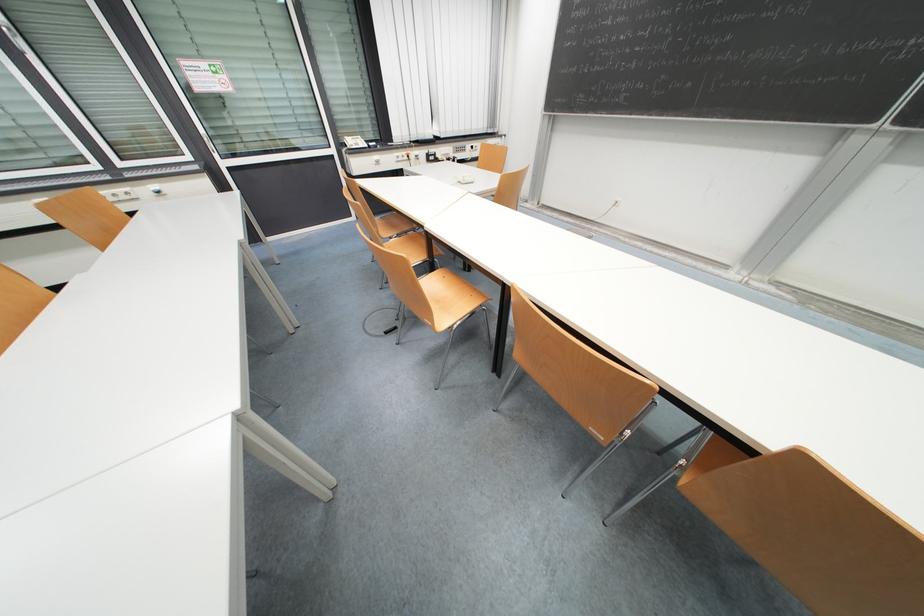
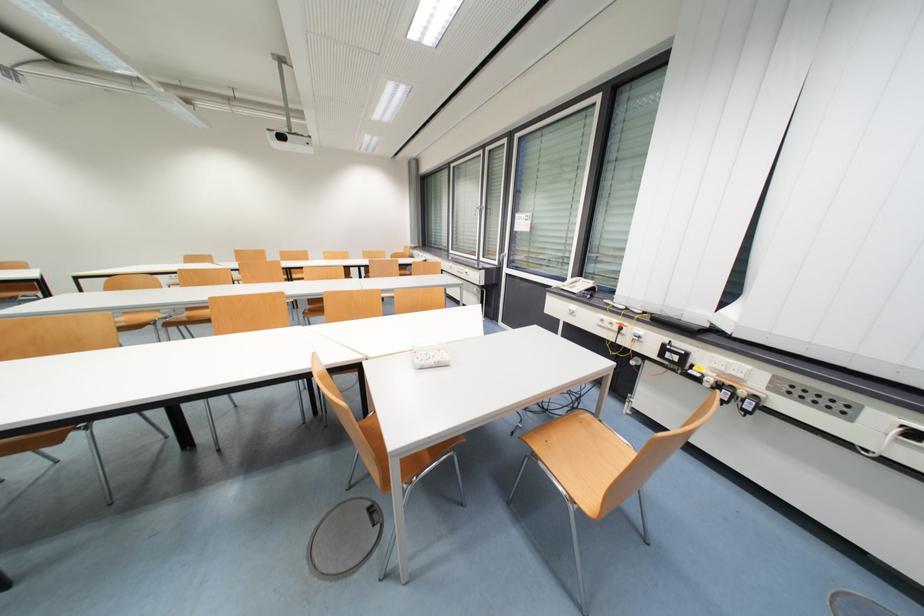
Locate, in the second image, the point that corresponds to (x=382, y=159) in the first image.

(578, 309)